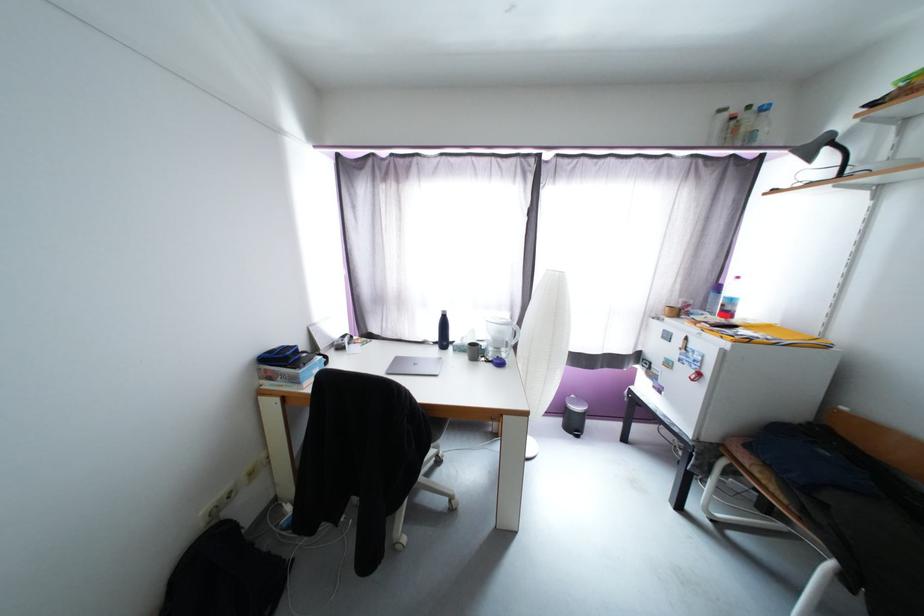
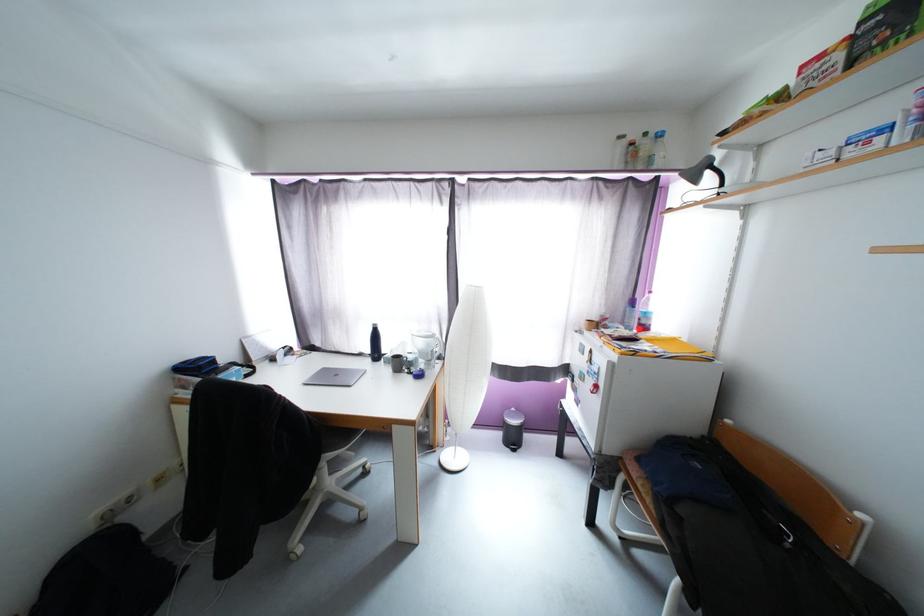
The point at (x=293, y=359) is marked in the first image. Where is the corresponding point in the second image?

(205, 369)